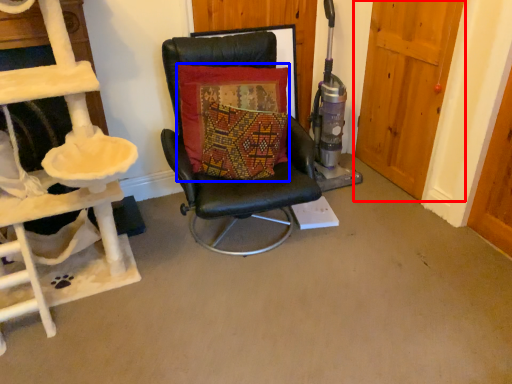
Question: Which of the following is the farthest to the observer, door (highlighted by a red box) or pillow (highlighted by a blue box)?

Choices:
 (A) door
 (B) pillow

Answer: (A)